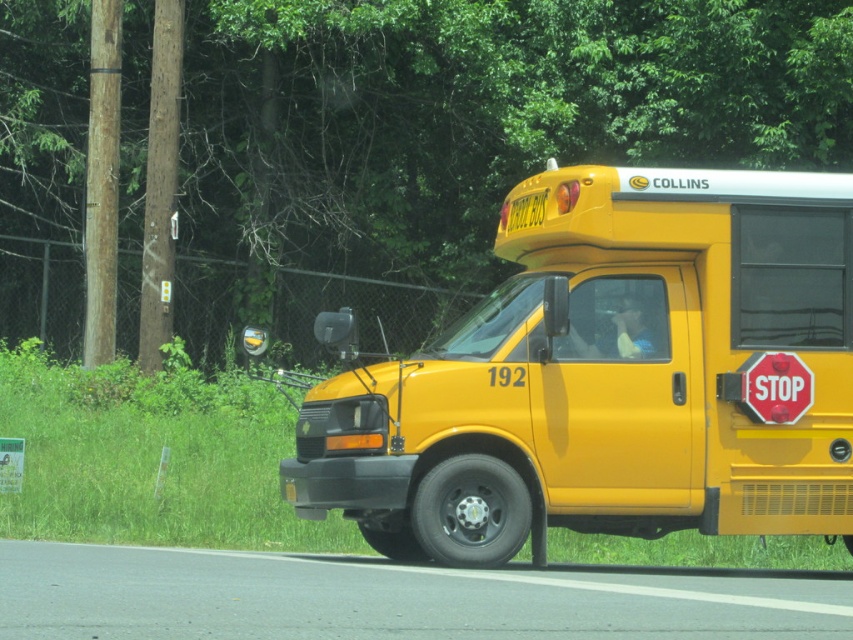
In the scene shown: You are a pedestrian standing on the sidewalk. You see the matte yellow school bus at center and the green leafy tree at upper center. Which object is closer to you?

The green leafy tree at upper center is closer to you because the matte yellow school bus at center is behind it.

You are a student waiting at the bus stop. You see the green leafy tree at upper center and the matte yellow school bus at center. Which object is located above the other?

The green leafy tree at upper center is positioned over matte yellow school bus at center.

Looking at this image, you are a driver approaching the matte yellow school bus at center and the red matte stop sign at center. Which object would appear closer to you if you are looking at them from the front of the bus?

The matte yellow school bus at center would appear closer to you since it is larger in size than the red matte stop sign at center.